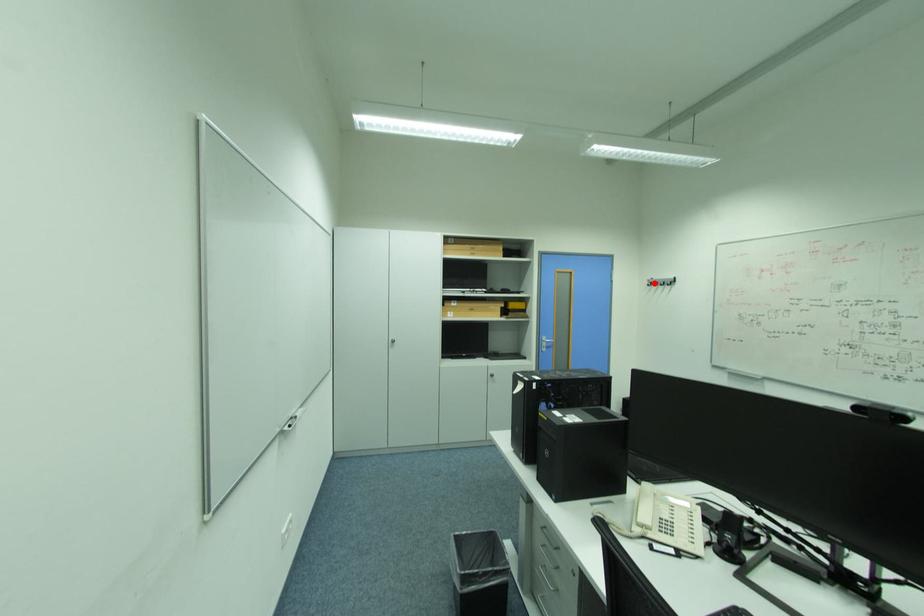
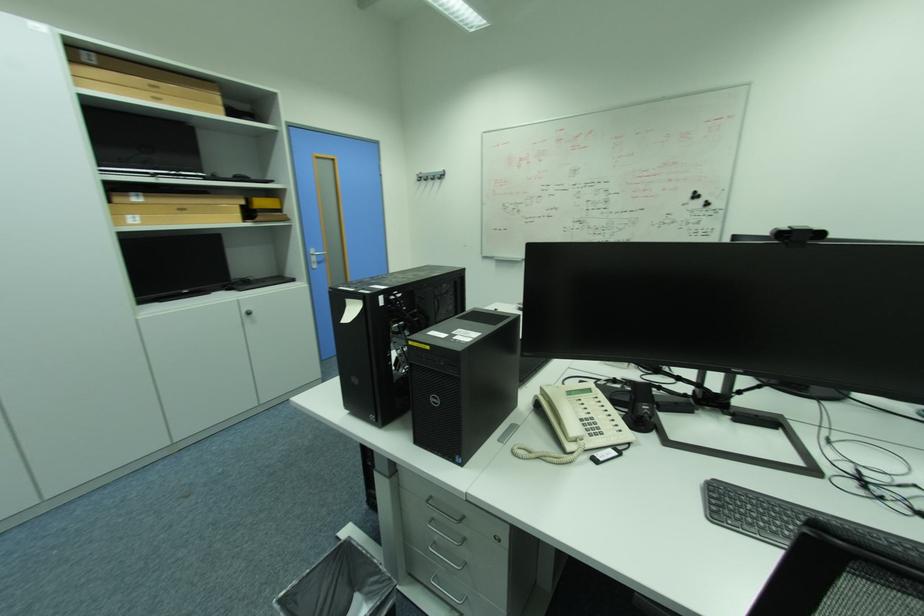
In the second image, find the point that corresponds to the highlighted location in the first image.

(421, 179)